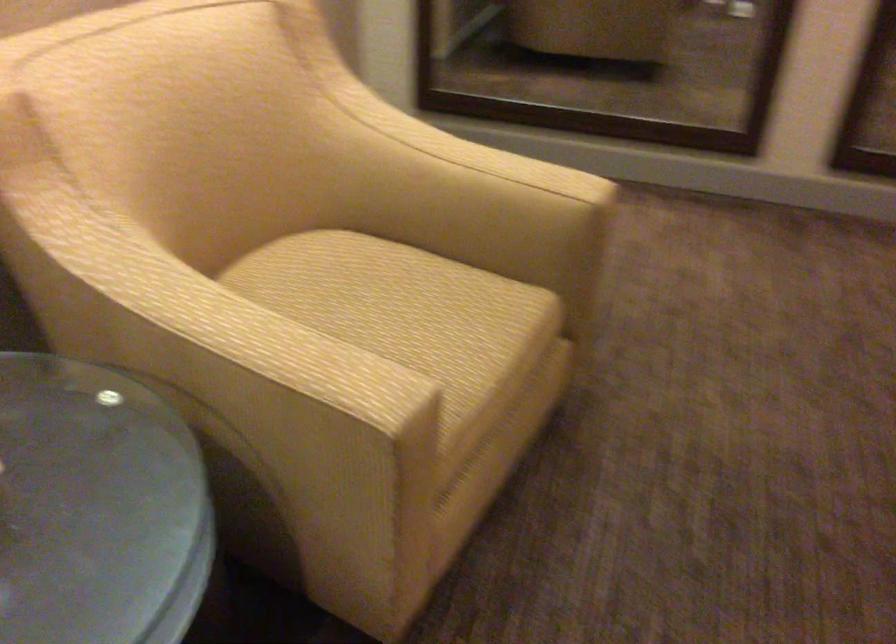
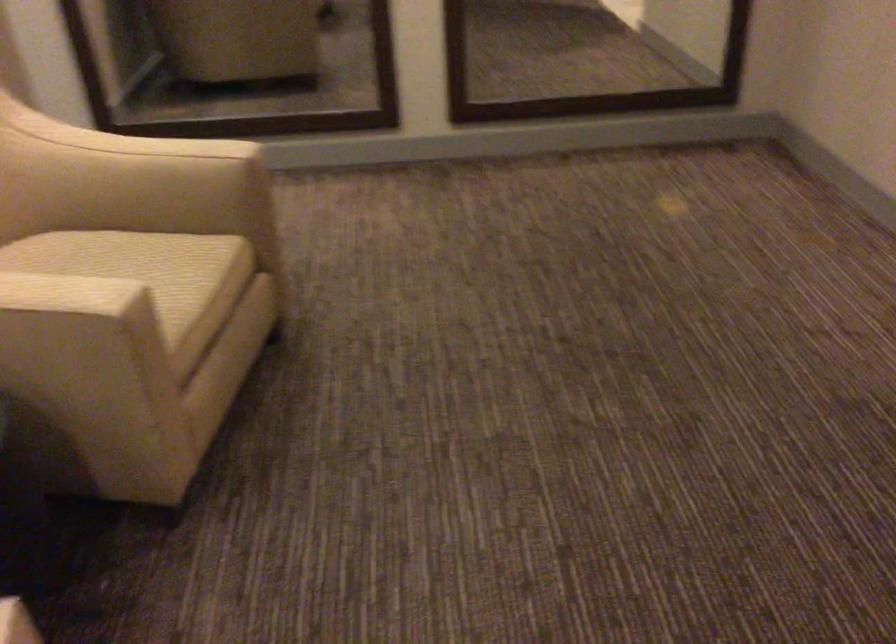
Locate, in the second image, the point that corresponds to [440,140] in the first image.

(116, 136)